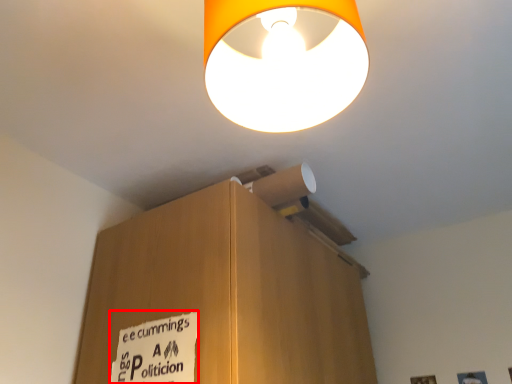
Question: From the image's perspective, what is the correct spatial positioning of warning sign (annotated by the red box) in reference to lamp?

Choices:
 (A) above
 (B) below

Answer: (B)